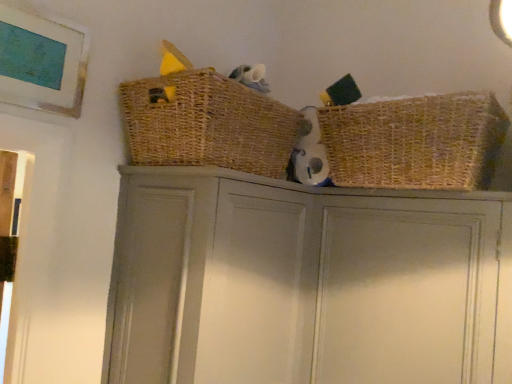
Question: Considering the relative positions of matte gray cupboard at center and woven straw basket at upper right, the first basket in the right-to-left sequence, in the image provided, is matte gray cupboard at center to the right of woven straw basket at upper right, the first basket in the right-to-left sequence, from the viewer's perspective?

Choices:
 (A) no
 (B) yes

Answer: (A)

Question: Considering the relative sizes of matte gray cupboard at center and woven straw basket at upper right, the first basket in the right-to-left sequence, in the image provided, is matte gray cupboard at center bigger than woven straw basket at upper right, the first basket in the right-to-left sequence,?

Choices:
 (A) no
 (B) yes

Answer: (B)

Question: Is matte gray cupboard at center at the left side of woven straw basket at upper right, the first basket in the right-to-left sequence?

Choices:
 (A) no
 (B) yes

Answer: (B)

Question: Does matte gray cupboard at center have a lesser width compared to woven straw basket at upper right, acting as the 2th basket starting from the left?

Choices:
 (A) no
 (B) yes

Answer: (A)

Question: Is matte gray cupboard at center turned away from woven straw basket at upper right, the first basket in the right-to-left sequence?

Choices:
 (A) no
 (B) yes

Answer: (A)

Question: Are matte gray cupboard at center and woven straw basket at upper right, acting as the 2th basket starting from the left, located far from each other?

Choices:
 (A) no
 (B) yes

Answer: (A)

Question: From the image's perspective, is woven brown basket at upper center, the 2th basket when ordered from right to left, beneath woven straw basket at upper right, the first basket in the right-to-left sequence?

Choices:
 (A) yes
 (B) no

Answer: (B)

Question: Could you tell me if woven brown basket at upper center, the 2th basket when ordered from right to left, is turned towards woven straw basket at upper right, the first basket in the right-to-left sequence?

Choices:
 (A) no
 (B) yes

Answer: (B)

Question: From a real-world perspective, is woven brown basket at upper center, the 2th basket when ordered from right to left, over woven straw basket at upper right, acting as the 2th basket starting from the left?

Choices:
 (A) yes
 (B) no

Answer: (A)

Question: Is woven brown basket at upper center, marked as the 1th basket in a left-to-right arrangement, oriented away from woven straw basket at upper right, the first basket in the right-to-left sequence?

Choices:
 (A) no
 (B) yes

Answer: (A)

Question: Is woven brown basket at upper center, the 2th basket when ordered from right to left, not inside woven straw basket at upper right, the first basket in the right-to-left sequence?

Choices:
 (A) yes
 (B) no

Answer: (A)

Question: Does woven brown basket at upper center, the 2th basket when ordered from right to left, have a larger size compared to woven straw basket at upper right, acting as the 2th basket starting from the left?

Choices:
 (A) no
 (B) yes

Answer: (B)

Question: Is woven straw basket at upper right, acting as the 2th basket starting from the left, thinner than woven brown basket at upper center, marked as the 1th basket in a left-to-right arrangement?

Choices:
 (A) yes
 (B) no

Answer: (A)